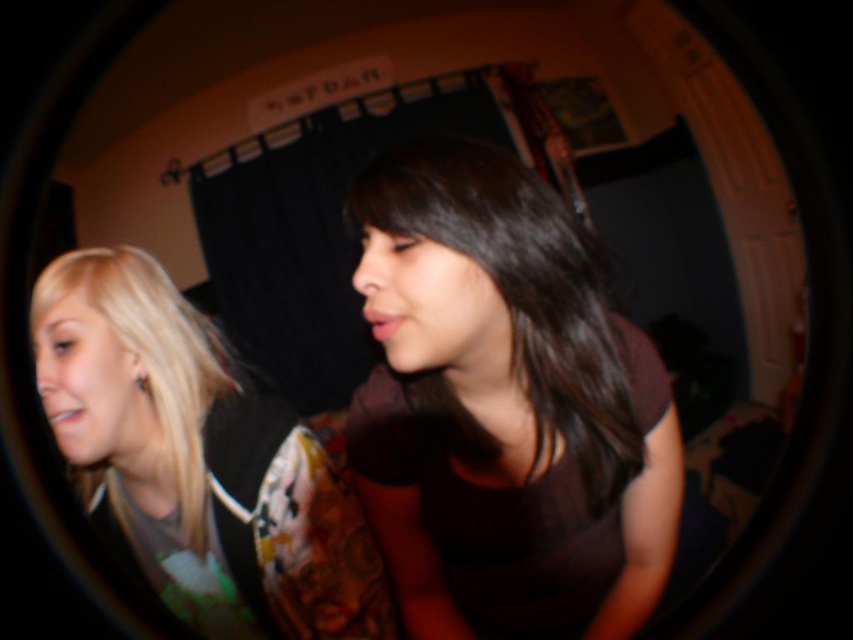
You are standing in front of the image and want to locate the dark brown fabric at center. What are its coordinates in the image?

The dark brown fabric at center is located at coordinates (503,406).

You are standing in the room shown in the image. There is a point at coordinates (503, 406). What is located at this point?

The point at coordinates (503, 406) indicates dark brown fabric at center.

You are a photographer trying to adjust the focus of your camera. You need to focus on the smaller object between the dark brown fabric at center and the blonde hair at left. Which object should you focus on?

The dark brown fabric at center is smaller than the blonde hair at left, so you should focus on the dark brown fabric at center.